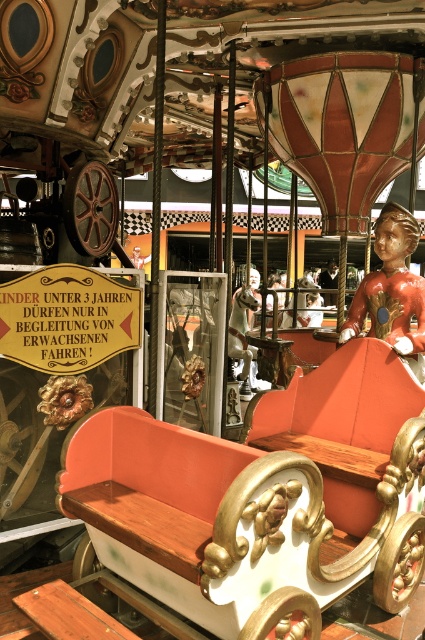
Question: Which point appears closest to the camera in this image?

Choices:
 (A) (96, 490)
 (B) (393, 346)

Answer: (A)

Question: Which object is closer to the camera taking this photo?

Choices:
 (A) shiny gold statue at center
 (B) wooden bench at center

Answer: (B)

Question: Is wooden bench at center closer to the viewer compared to shiny gold statue at center?

Choices:
 (A) no
 (B) yes

Answer: (B)

Question: Is wooden bench at center to the left of shiny gold statue at center from the viewer's perspective?

Choices:
 (A) no
 (B) yes

Answer: (B)

Question: Can you confirm if wooden bench at center is wider than shiny gold statue at center?

Choices:
 (A) yes
 (B) no

Answer: (A)